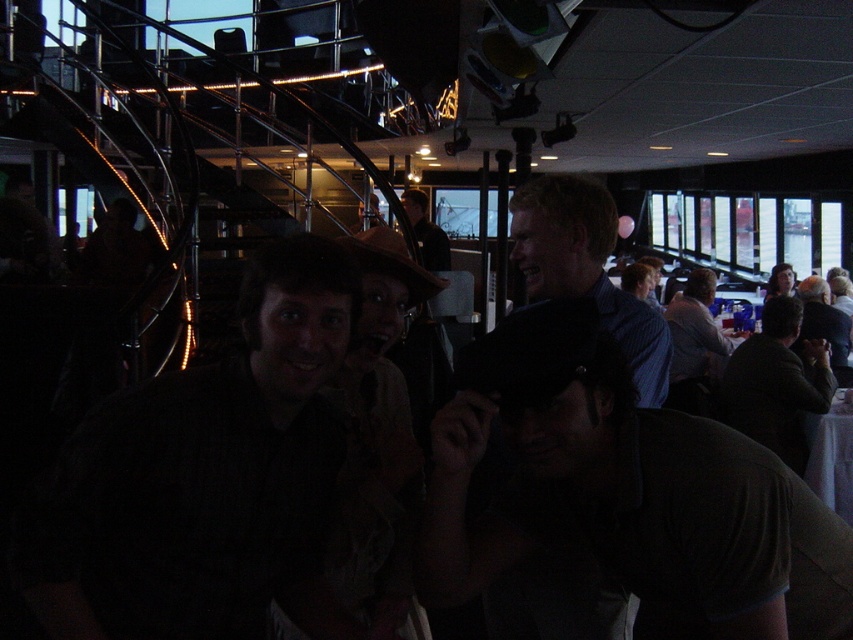
Is matte brown hat at center smaller than dark brown leather jacket at upper center?

Incorrect, matte brown hat at center is not smaller in size than dark brown leather jacket at upper center.

Is point (688, 442) in front of point (413, 209)?

Yes, it is.

Identify the location of matte brown hat at center. (618, 465).

Where is `matte brown hat at center`? This screenshot has width=853, height=640. matte brown hat at center is located at coordinates (618, 465).

Does matte brown hat at center have a lesser width compared to dark brown shirt at center?

No, matte brown hat at center is not thinner than dark brown shirt at center.

Can you confirm if matte brown hat at center is shorter than dark brown shirt at center?

Indeed, matte brown hat at center has a lesser height compared to dark brown shirt at center.

Which is in front, point (485, 406) or point (119, 474)?

Point (485, 406) is more forward.

I want to click on matte brown hat at center, so click(x=618, y=465).

Which of these two, dark brown leather jacket at right or dark brown leather jacket at upper center, stands taller?

With more height is dark brown leather jacket at right.

Can you confirm if dark brown leather jacket at right is wider than dark brown leather jacket at upper center?

Yes.

Does point (752, 349) come behind point (413, 198)?

No, it is not.

You are a GUI agent. You are given a task and a screenshot of the screen. Output one action in this format:
    pyautogui.click(x=<x>, y=<y>)
    Task: Click on the dark brown leather jacket at right
    Image resolution: width=853 pixels, height=640 pixels.
    Given the screenshot: What is the action you would take?
    pyautogui.click(x=776, y=381)